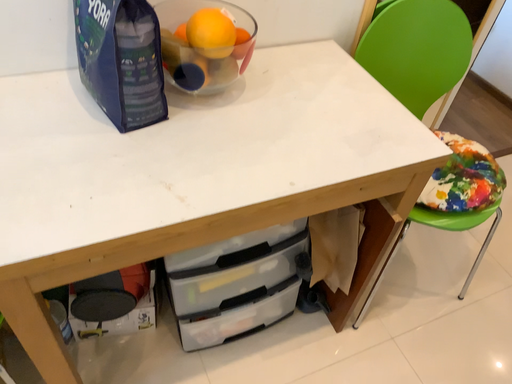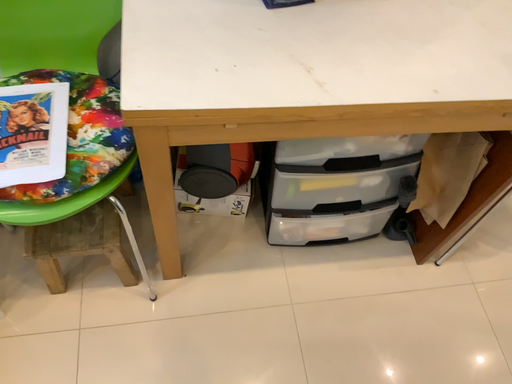
Question: Which way did the camera rotate in the video?

Choices:
 (A) rotated left
 (B) rotated right

Answer: (A)